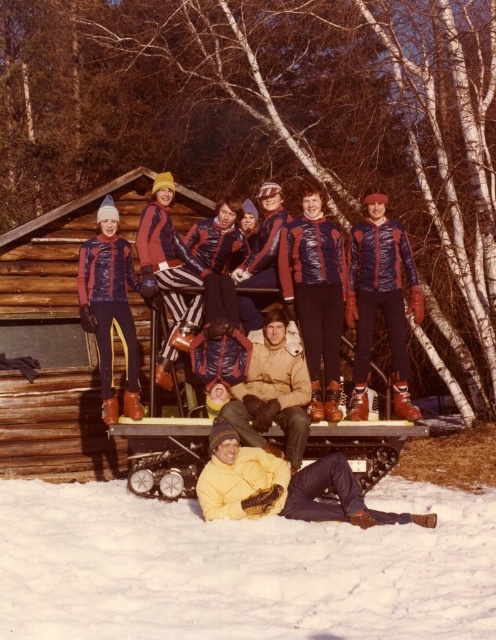
Question: Which point is farther to the camera?

Choices:
 (A) white fluffy snow at lower center
 (B) yellow matte jacket at lower center

Answer: (B)

Question: Can you confirm if matte blue ski suit at left is bigger than tan suede jacket at center?

Choices:
 (A) yes
 (B) no

Answer: (A)

Question: Which point is farther to the camera?

Choices:
 (A) (9, 632)
 (B) (129, 285)

Answer: (B)

Question: Does white fluffy snow at lower center have a lesser width compared to matte blue ski suit at left?

Choices:
 (A) no
 (B) yes

Answer: (A)

Question: Which object is the closest to the matte blue ski suit at left?

Choices:
 (A) tan suede jacket at center
 (B) white fluffy snow at lower center

Answer: (A)

Question: Is white fluffy snow at lower center thinner than matte blue ski suit at left?

Choices:
 (A) no
 (B) yes

Answer: (A)